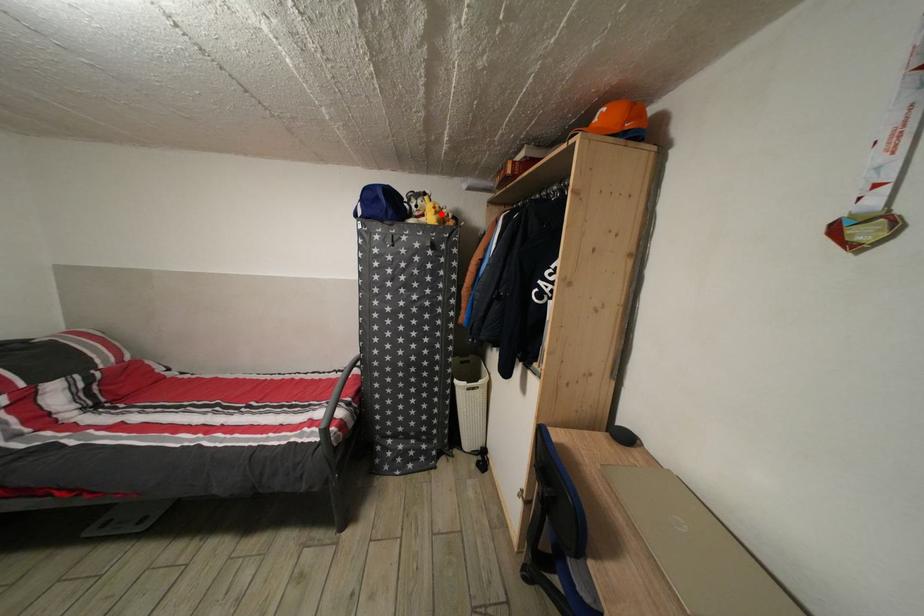
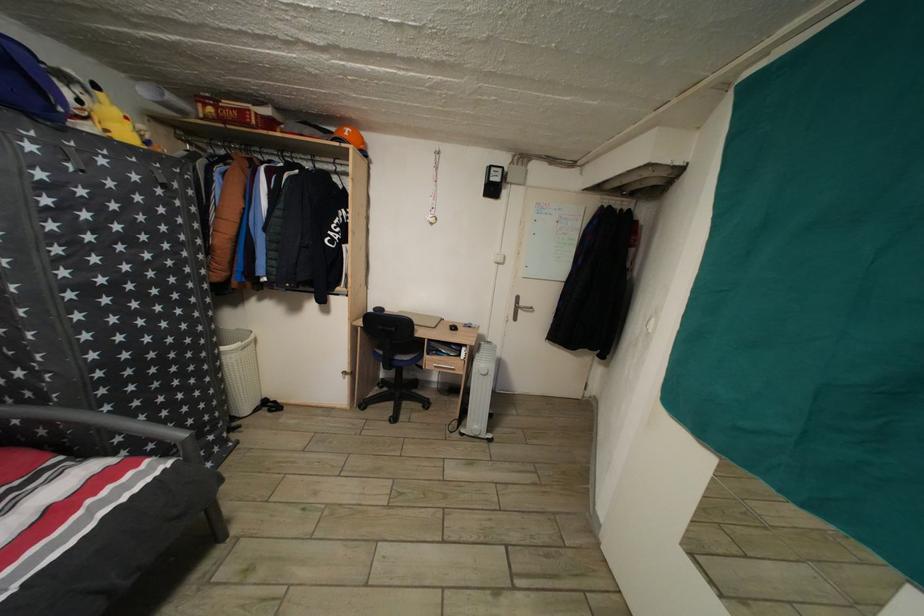
Question: I am providing you with two images of the same scene from different viewpoints. A red point is shown in image1. For the corresponding object point in image2, is it positioned nearer or farther from the camera?

Choices:
 (A) Nearer
 (B) Farther

Answer: (B)